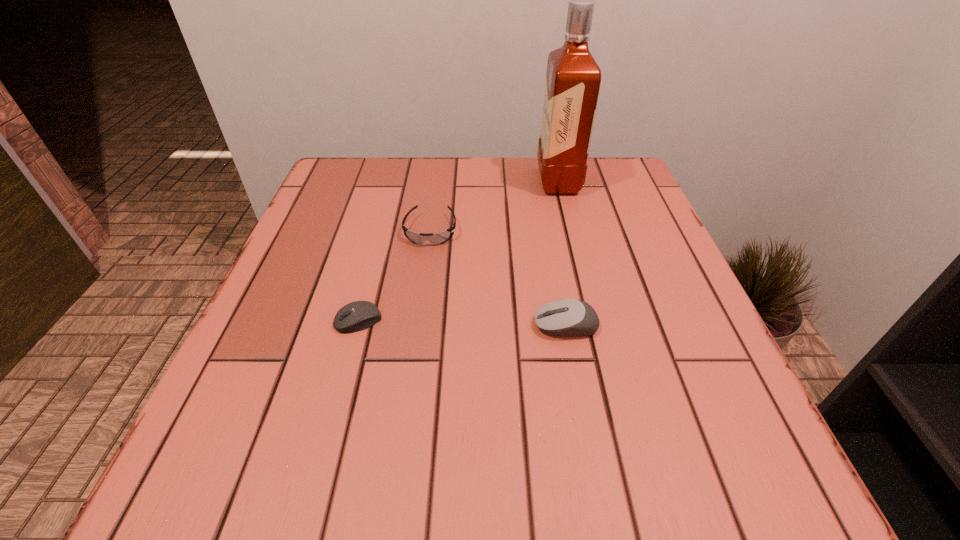
Image resolution: width=960 pixels, height=540 pixels. What are the coordinates of `vacant space that satisfies the following two spatial constraints: 1. on the front label of the tallest object; 2. on the lenses of the sunglasses` in the screenshot? It's located at (570, 231).

Where is `free space that satisfies the following two spatial constraints: 1. on the front label of the liquor; 2. on the lenses of the third object from right to left`? This screenshot has height=540, width=960. free space that satisfies the following two spatial constraints: 1. on the front label of the liquor; 2. on the lenses of the third object from right to left is located at coordinates [x=570, y=231].